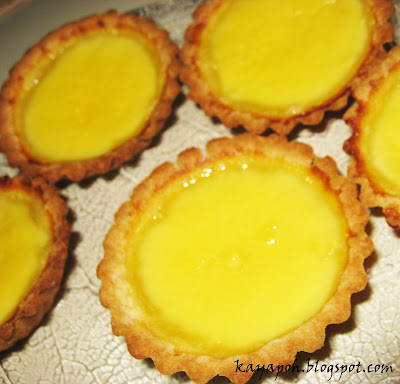
Where is `table`? table is located at coordinates (23, 21).